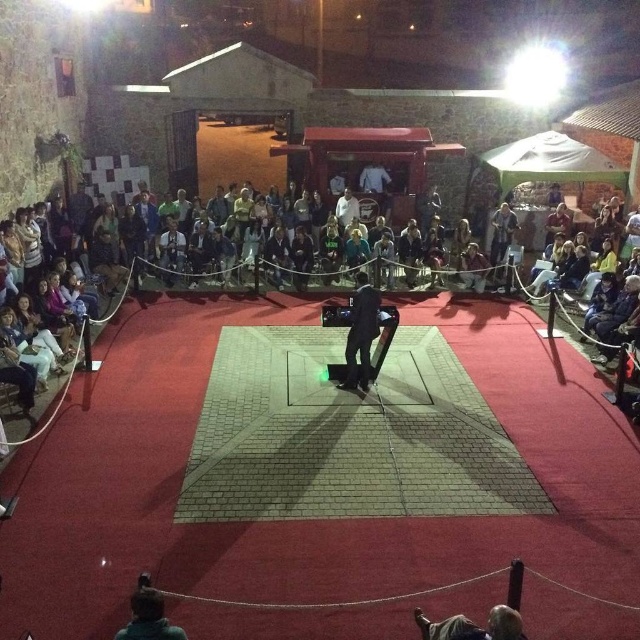
Is dark gray fabric pants at center shorter than white cotton shirt at center?

In fact, dark gray fabric pants at center may be taller than white cotton shirt at center.

Between point (342, 381) and point (342, 198), which one is positioned behind?

The point (342, 198) is more distant.

The width and height of the screenshot is (640, 640). What are the coordinates of `dark gray fabric pants at center` in the screenshot? It's located at (360, 333).

Describe the element at coordinates (170, 252) in the screenshot. I see `light brown leather jacket at center` at that location.

Can you confirm if light brown leather jacket at center is bigger than white cotton shirt at center?

Indeed, light brown leather jacket at center has a larger size compared to white cotton shirt at center.

The height and width of the screenshot is (640, 640). What do you see at coordinates (170, 252) in the screenshot?
I see `light brown leather jacket at center` at bounding box center [170, 252].

The height and width of the screenshot is (640, 640). I want to click on light brown leather jacket at center, so click(x=170, y=252).

Can you confirm if dark gray fabric pants at center is positioned to the right of light brown leather jacket at center?

Correct, you'll find dark gray fabric pants at center to the right of light brown leather jacket at center.

Between dark gray fabric pants at center and light brown leather jacket at center, which one is positioned higher?

light brown leather jacket at center is higher up.

Between point (346, 376) and point (173, 260), which one is positioned in front?

Positioned in front is point (346, 376).

At what (x,y) coordinates should I click in order to perform the action: click on dark gray fabric pants at center. Please return your answer as a coordinate pair (x, y). This screenshot has width=640, height=640. Looking at the image, I should click on (360, 333).